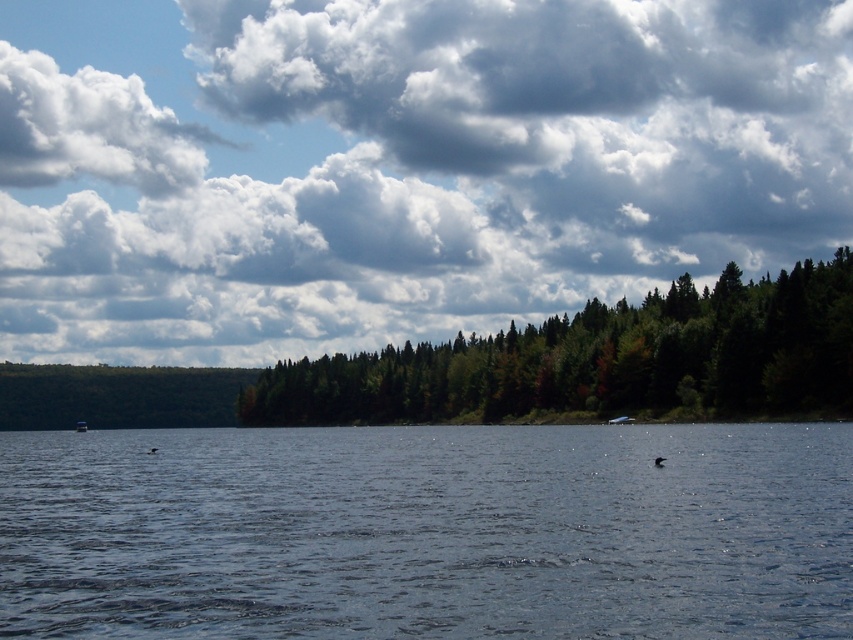
You are standing on the lakeside and see the blue water at center and the blue plastic boat at center. Which one appears taller from your perspective?

The blue water at center appears taller than the blue plastic boat at center from your perspective.